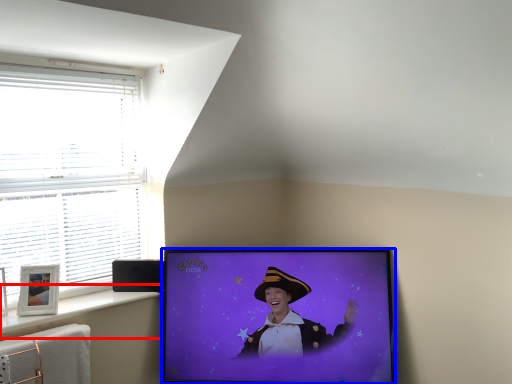
Question: Which point is closer to the camera, window sill (highlighted by a red box) or television (highlighted by a blue box)?

Choices:
 (A) window sill
 (B) television

Answer: (A)